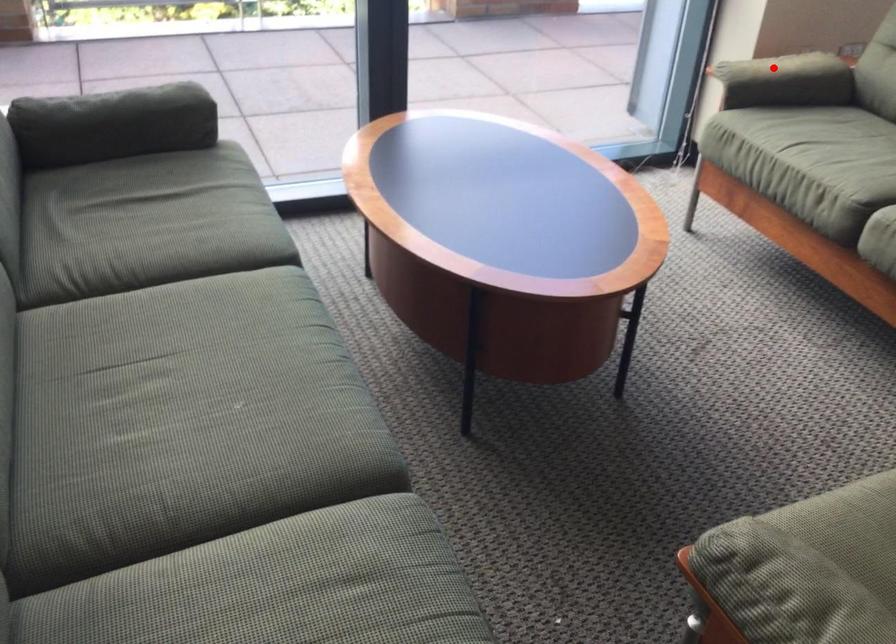
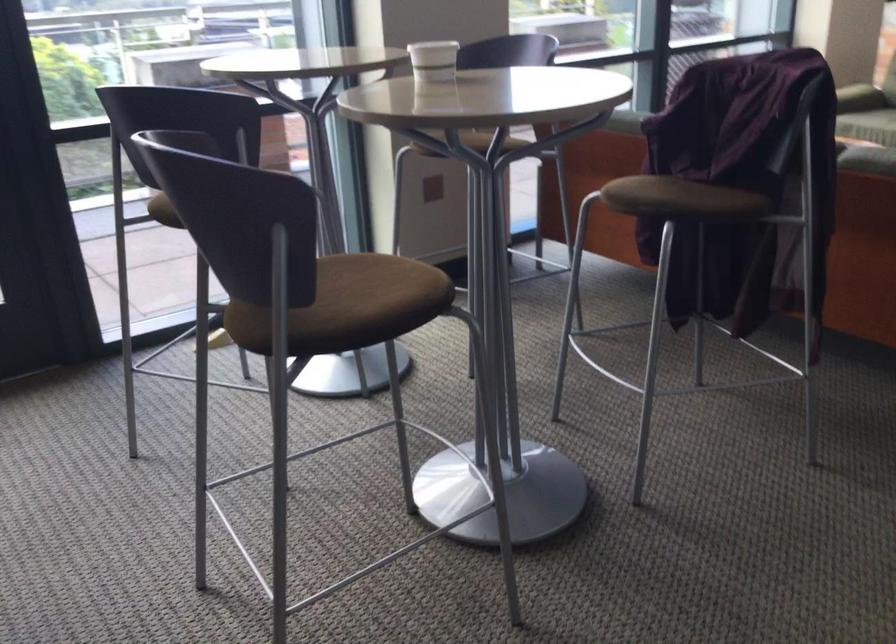
Question: I am providing you with two images of the same scene from different viewpoints. A red point is marked on the first image. Can you still see the location of the red point in image 2?

Choices:
 (A) Yes
 (B) No

Answer: (B)